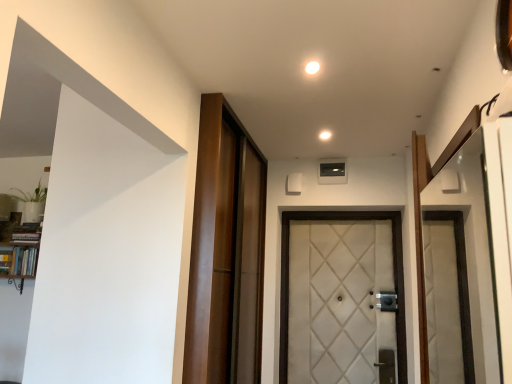
Question: Choose the correct answer: Is wooden barn door at center inside wooden bookshelf at left or outside it?

Choices:
 (A) inside
 (B) outside

Answer: (B)

Question: In the image, is wooden barn door at center positioned in front of or behind wooden bookshelf at left?

Choices:
 (A) front
 (B) behind

Answer: (A)

Question: Which is farther from the wooden barn door at center?

Choices:
 (A) white quilted fabric door at center
 (B) white glossy light at upper center, the 2th light ordered from the bottom
 (C) wooden bookshelf at left
 (D) white glossy light at center, marked as the 2th light in a top-to-bottom arrangement

Answer: (C)

Question: Which object is the farthest from the white quilted fabric door at center?

Choices:
 (A) white glossy light at upper center, the 2th light ordered from the bottom
 (B) wooden barn door at center
 (C) white glossy light at center, placed as the 1th light when sorted from back to front
 (D) wooden bookshelf at left

Answer: (D)